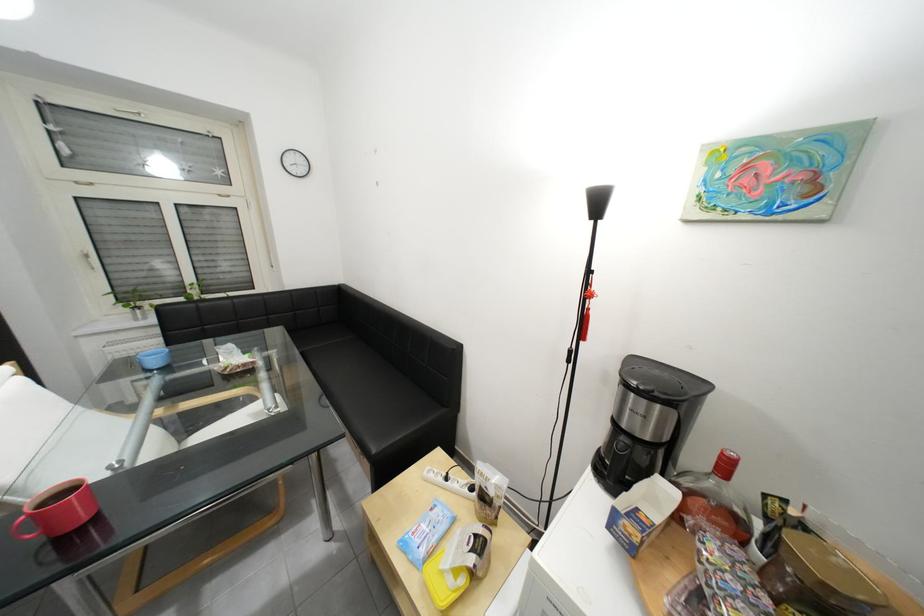
In order to click on red bottle cap in this screenshot , I will do `click(725, 464)`.